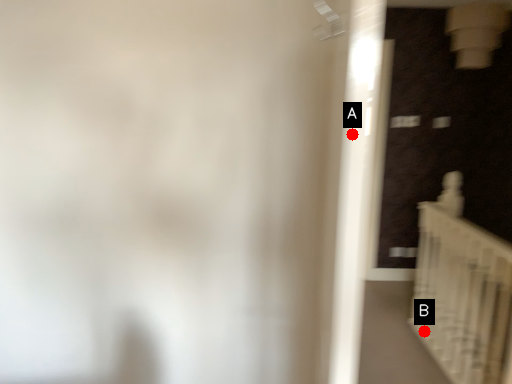
Question: Two points are circled on the image, labeled by A and B beside each circle. Which of the following is the closest to the observer?

Choices:
 (A) A is closer
 (B) B is closer

Answer: (A)